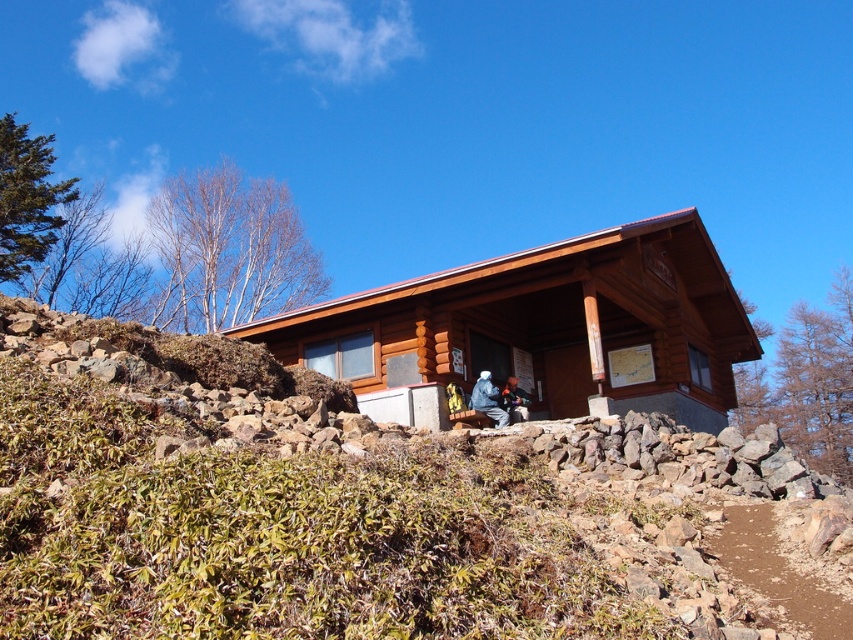
Question: Can you confirm if brown wooden cabin at center is bigger than dark blue jacket at lower center?

Choices:
 (A) yes
 (B) no

Answer: (A)

Question: Which of these objects is positioned farthest from the brown wooden log cabin at center?

Choices:
 (A) dark blue jacket at lower center
 (B) blue fuzzy jacket at center

Answer: (A)

Question: Is blue fuzzy jacket at center smaller than dark blue jacket at lower center?

Choices:
 (A) yes
 (B) no

Answer: (A)

Question: Which object is positioned closest to the dark blue jacket at lower center?

Choices:
 (A) brown wooden log cabin at center
 (B) brown wooden cabin at center
 (C) blue fuzzy jacket at center

Answer: (C)

Question: Which of the following is the closest to the observer?

Choices:
 (A) dark blue jacket at lower center
 (B) brown wooden cabin at center

Answer: (B)

Question: Where is brown wooden log cabin at center located in relation to brown wooden cabin at center in the image?

Choices:
 (A) below
 (B) above

Answer: (A)